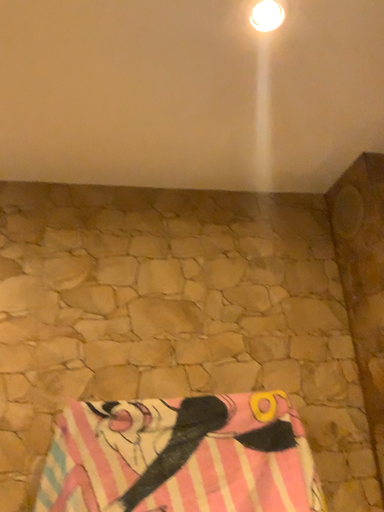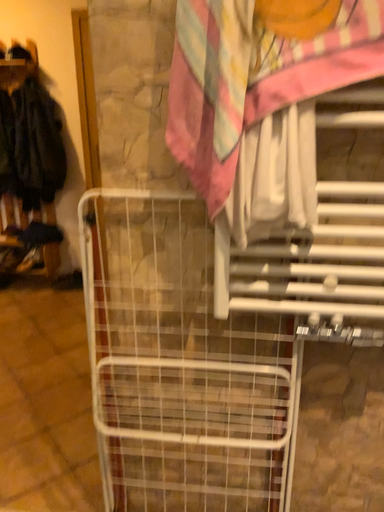
Question: How did the camera likely rotate when shooting the video?

Choices:
 (A) rotated right
 (B) rotated left

Answer: (B)